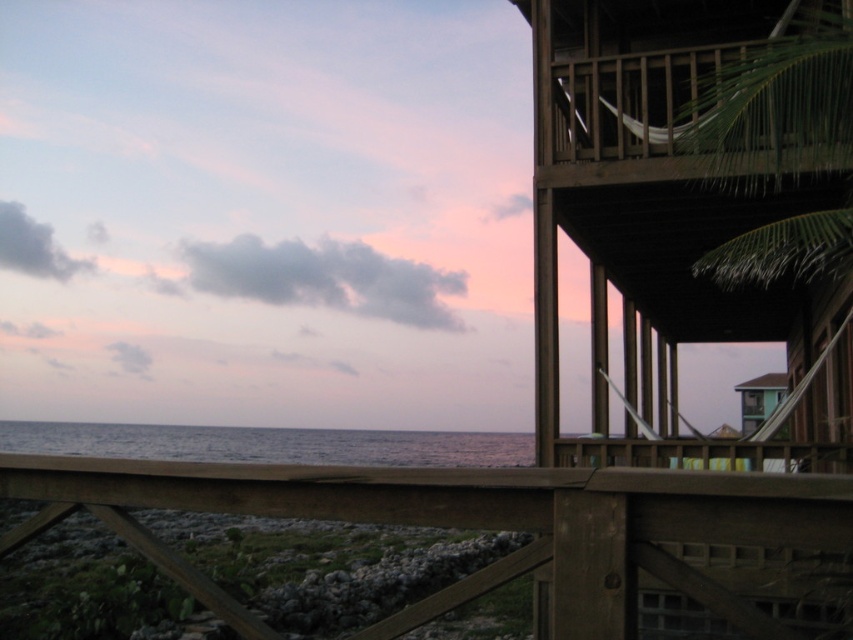
You are standing on the wooden railing in the foreground of the coastal scene. You want to walk towards the brown wooden deck at lower center represented by point (471, 524). Which direction should you move relative to your current position?

You should move towards the direction of point (471, 524) to reach the brown wooden deck at lower center.

You are standing at the edge of the brown wooden balcony at upper right and want to jump into the ocean below. The safety guidelines state that a safe jump height is less than 5 meters. Is this jump safe?

The distance between the brown wooden balcony at upper right and the viewer is 6.82 meters, but this measurement might not directly indicate the height of the balcony above the ocean. The safety guidelines mention height, not distance from the viewer. Without knowing the actual height of the balcony, it is impossible to determine if the jump is safe.

You are standing on the brown wooden deck at lower center and want to take a photo of the green leafy palm tree at upper right. Considering their sizes, which one will appear larger in the photo?

The brown wooden deck at lower center will appear larger in the photo because its width surpasses that of the green leafy palm tree at upper right.